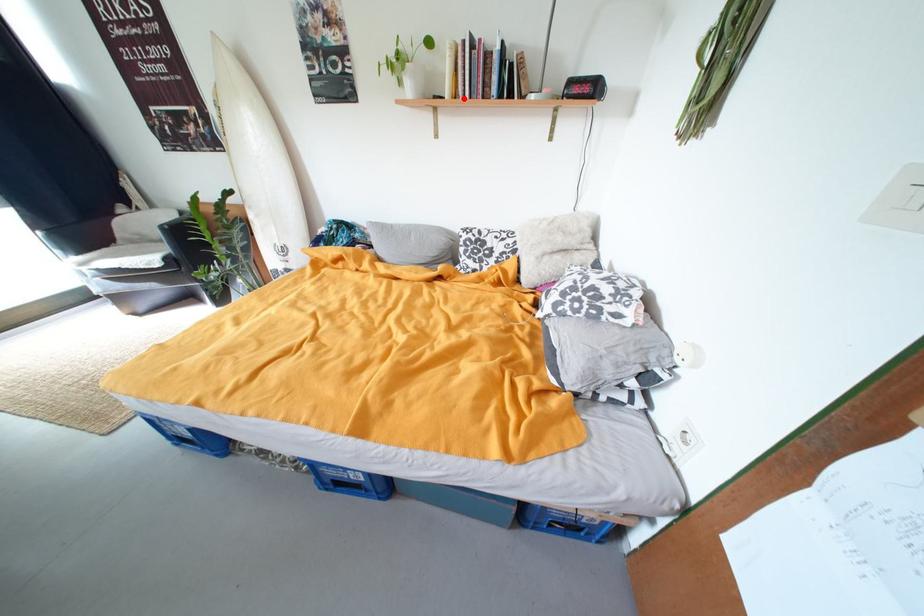
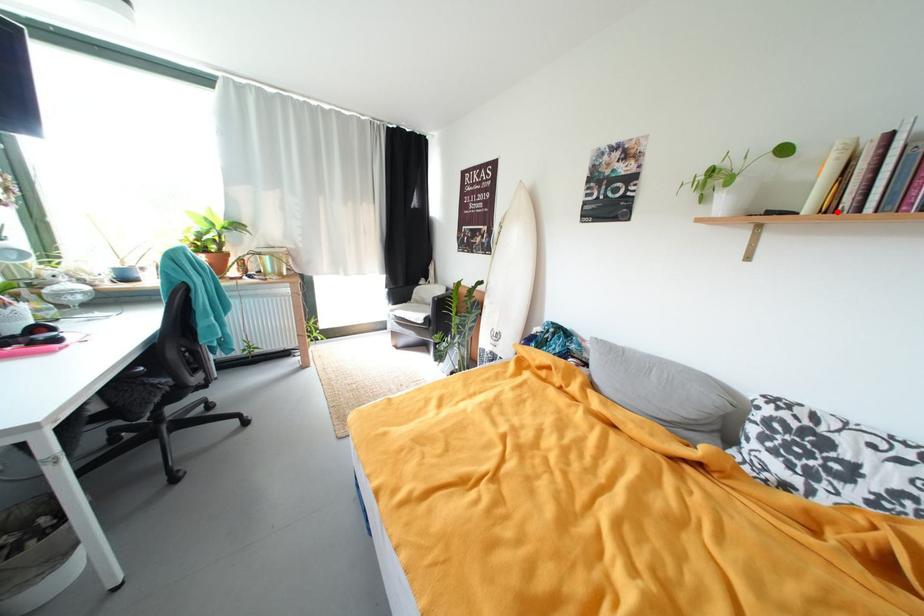
I am providing you with two images of the same scene from different viewpoints. A red point is marked on the first image and another point is marked on the second image. Is the marked point in image1 the same physical position as the marked point in image2?

→ Yes